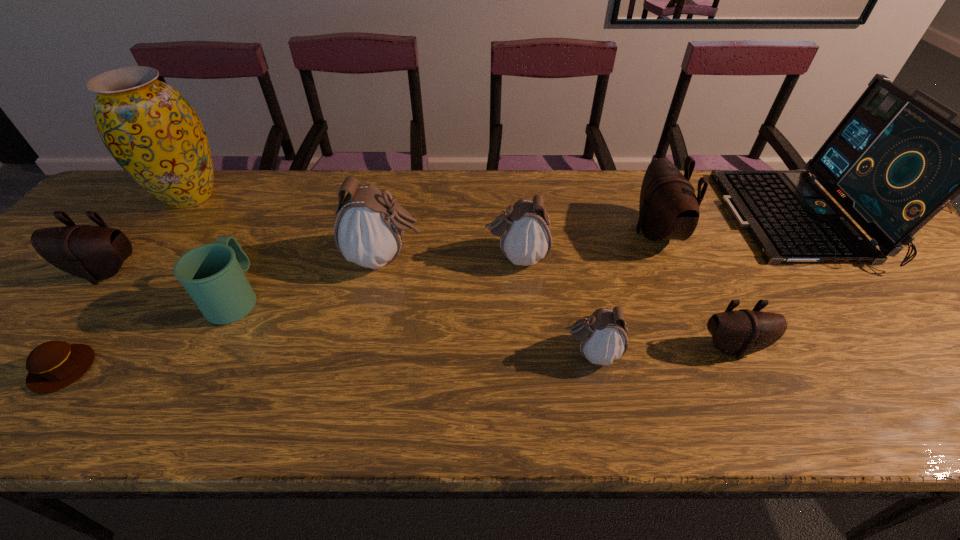
What are the coordinates of `free location located 0.270m with the flap open on the biggest brown pouch` in the screenshot? It's located at (534, 232).

Identify the location of blank area located with the flap open on the biggest brown pouch. The width and height of the screenshot is (960, 540). (601, 232).

You are a GUI agent. You are given a task and a screenshot of the screen. Output one action in this format:
    pyautogui.click(x=<x>, y=<y>)
    Task: Click on the vacant region located 0.210m on the front-facing side of the second smallest white pouch
    Image resolution: width=960 pixels, height=540 pixels.
    Given the screenshot: What is the action you would take?
    pyautogui.click(x=401, y=257)

Where is `vacant space located 0.340m on the front-facing side of the second smallest white pouch`? vacant space located 0.340m on the front-facing side of the second smallest white pouch is located at coordinates (350, 257).

The height and width of the screenshot is (540, 960). Identify the location of vacant space located on the front-facing side of the second smallest white pouch. [x=437, y=257].

You are a GUI agent. You are given a task and a screenshot of the screen. Output one action in this format:
    pyautogui.click(x=<x>, y=<y>)
    Task: Click on the vacant space located with the flap open on the leftmost pouch
    
    Given the screenshot: What is the action you would take?
    pyautogui.click(x=7, y=393)

Locate an element on the screen. The image size is (960, 540). free region located on the side of the fourth object from left to right with the handle is located at coordinates (284, 202).

This screenshot has width=960, height=540. I want to click on blank area located on the side of the fourth object from left to right with the handle, so click(270, 232).

Find the location of `free space located on the side of the fourth object from left to right with the handle`. free space located on the side of the fourth object from left to right with the handle is located at coordinates (293, 187).

Identify the location of free spot located on the front-facing side of the nearest white pouch. (403, 353).